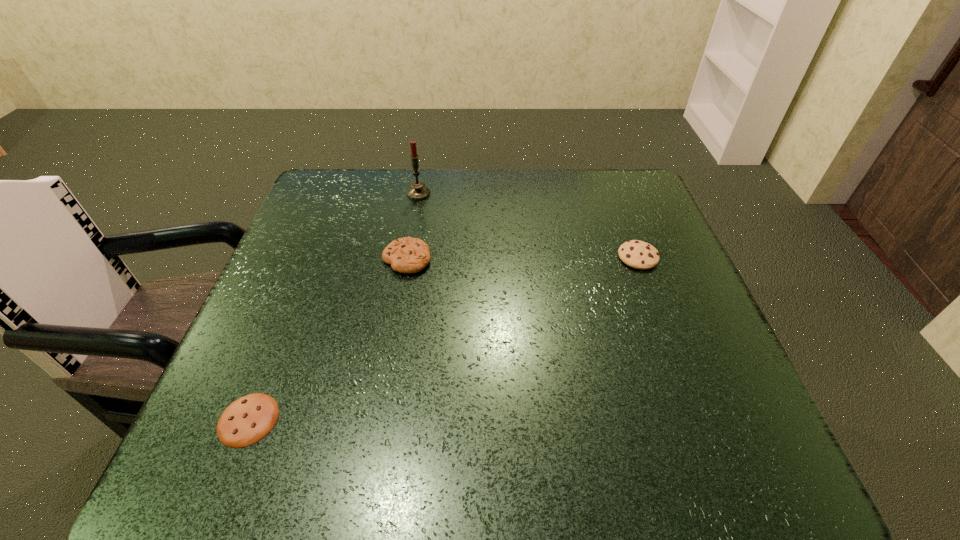
Locate an element on the screen. Image resolution: width=960 pixels, height=540 pixels. vacant space that is in between the farthest object and the rightmost object is located at coordinates (528, 226).

Where is `blank region between the farthest object and the second cookie from left to right`? blank region between the farthest object and the second cookie from left to right is located at coordinates [413, 226].

Choose which object is the third nearest neighbor to the leftmost cookie. Please provide its 2D coordinates. Your answer should be formatted as a tuple, i.e. [(x, y)], where the tuple contains the x and y coordinates of a point satisfying the conditions above.

[(637, 254)]

Locate an element on the screen. The height and width of the screenshot is (540, 960). object that is the third closest to the rightmost cookie is located at coordinates (247, 420).

Locate an element on the screen. This screenshot has height=540, width=960. cookie identified as the second closest to the leftmost cookie is located at coordinates (637, 254).

This screenshot has height=540, width=960. I want to click on cookie that stands as the closest to the second cookie from right to left, so click(247, 420).

Find the location of a particular element. free space that satisfies the following two spatial constraints: 1. on the front side of the farthest object; 2. on the right side of the rightmost cookie is located at coordinates (408, 257).

Identify the location of vacant space that satisfies the following two spatial constraints: 1. on the back side of the tallest object; 2. on the left side of the shortest object. 338,194.